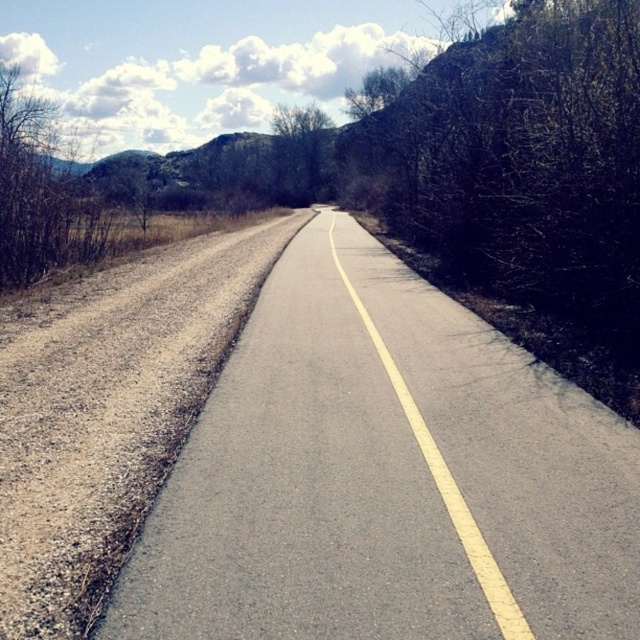
Who is positioned more to the right, asphalt road at center or green leafy tree at center?

asphalt road at center is more to the right.

Describe the element at coordinates (385, 476) in the screenshot. I see `asphalt road at center` at that location.

What do you see at coordinates (385, 476) in the screenshot? I see `asphalt road at center` at bounding box center [385, 476].

The height and width of the screenshot is (640, 640). Find the location of `asphalt road at center`. asphalt road at center is located at coordinates (385, 476).